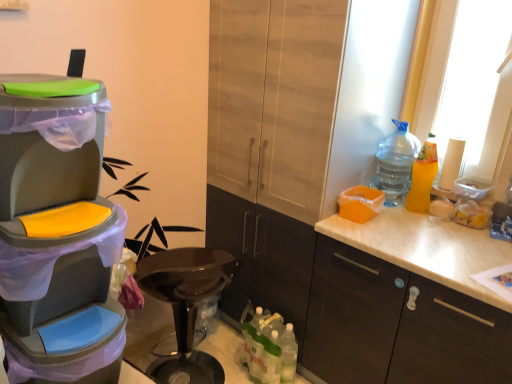
Question: Is matte plastic trash can at left wider than translucent plastic bottles at lower center, which is the third bottle from right to left?

Choices:
 (A) yes
 (B) no

Answer: (A)

Question: Is matte plastic trash can at left positioned beyond the bounds of translucent plastic bottles at lower center, which appears as the third bottle when viewed from the top?

Choices:
 (A) yes
 (B) no

Answer: (A)

Question: Is matte plastic trash can at left aimed at translucent plastic bottles at lower center, the first bottle when ordered from left to right?

Choices:
 (A) yes
 (B) no

Answer: (B)

Question: From the image's perspective, is matte plastic trash can at left located above translucent plastic bottles at lower center, which is the third bottle from right to left?

Choices:
 (A) yes
 (B) no

Answer: (A)

Question: Is matte plastic trash can at left to the left of translucent plastic bottles at lower center, which is the third bottle from right to left, from the viewer's perspective?

Choices:
 (A) no
 (B) yes

Answer: (B)

Question: Is translucent plastic bottles at lower center, the first bottle when ordered from left to right, at the back of matte plastic trash can at left?

Choices:
 (A) no
 (B) yes

Answer: (A)

Question: Is matte plastic trash can at left positioned before white matte cabinet at right, arranged as the 1th cabinetry when viewed from the right?

Choices:
 (A) yes
 (B) no

Answer: (A)

Question: Can you confirm if matte plastic trash can at left is shorter than white matte cabinet at right, which is the second cabinetry from left to right?

Choices:
 (A) no
 (B) yes

Answer: (B)

Question: Is matte plastic trash can at left smaller than white matte cabinet at right, which is the second cabinetry from left to right?

Choices:
 (A) yes
 (B) no

Answer: (A)

Question: Considering the relative sizes of matte plastic trash can at left and white matte cabinet at right, which is the second cabinetry from left to right, in the image provided, is matte plastic trash can at left bigger than white matte cabinet at right, which is the second cabinetry from left to right,?

Choices:
 (A) yes
 (B) no

Answer: (B)

Question: Does matte plastic trash can at left have a greater width compared to white matte cabinet at right, which is the second cabinetry from left to right?

Choices:
 (A) yes
 (B) no

Answer: (B)

Question: Can we say matte plastic trash can at left lies outside white matte cabinet at right, arranged as the 1th cabinetry when viewed from the right?

Choices:
 (A) no
 (B) yes

Answer: (B)

Question: Is matte wood cabinet at center, which is the 2th cabinetry in right-to-left order, touching white matte cabinet at right, arranged as the 1th cabinetry when viewed from the right?

Choices:
 (A) no
 (B) yes

Answer: (A)